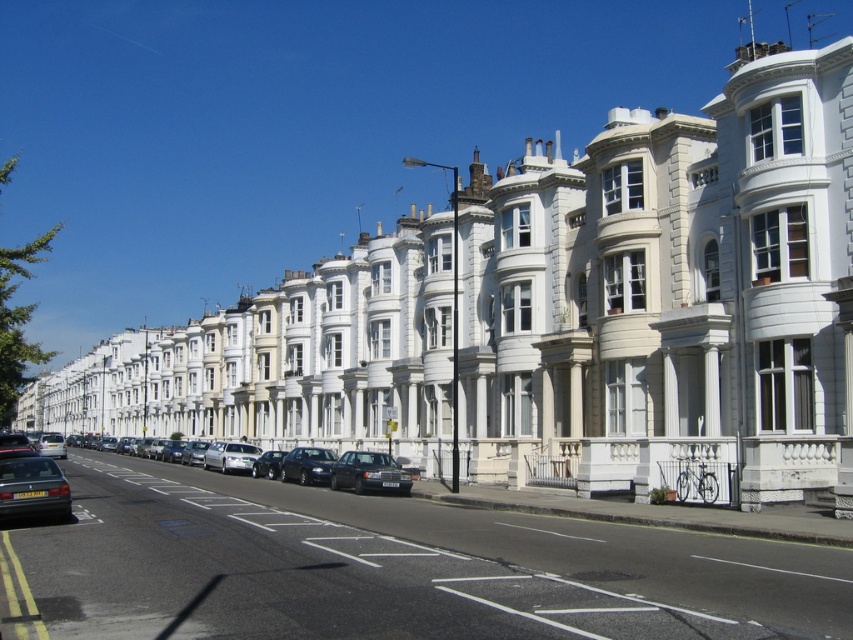
Question: Does silver metallic car at center have a lesser width compared to silver metallic car at center-left?

Choices:
 (A) no
 (B) yes

Answer: (B)

Question: Among these points, which one is nearest to the camera?

Choices:
 (A) (274, 468)
 (B) (282, 476)
 (C) (54, 435)

Answer: (B)

Question: Does silver metallic car at center lie behind silver metallic car at center-left?

Choices:
 (A) yes
 (B) no

Answer: (B)

Question: Estimate the real-world distances between objects in this image. Which object is farther from the shiny silver car at center?

Choices:
 (A) silver metallic car at center
 (B) dark gray metallic sedan at center
 (C) satin black sedan at center
 (D) shiny silver sedan at center

Answer: (B)

Question: Among these objects, which one is farthest from the camera?

Choices:
 (A) silver metallic car at center-left
 (B) shiny silver car at center
 (C) silver metallic car at center

Answer: (A)

Question: Does shiny silver car at center appear on the right side of silver metallic car at center-left?

Choices:
 (A) no
 (B) yes

Answer: (B)